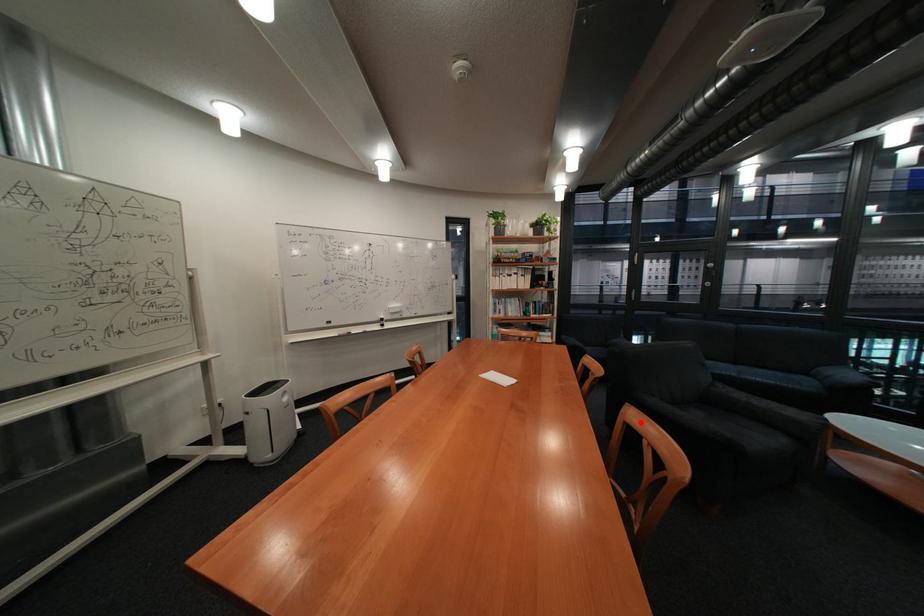
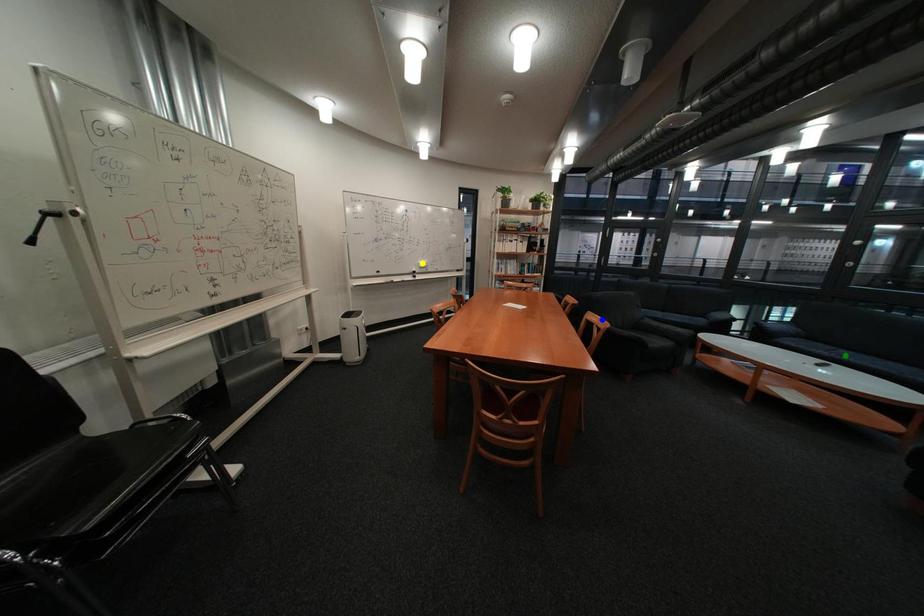
Question: I am providing you with two images of the same scene from different viewpoints. A red point is marked on the first image. You are given multiple points on the second image. Can you choose the point in image 2 that corresponds to the point in image 1?

Choices:
 (A) blue point
 (B) green point
 (C) yellow point

Answer: (A)